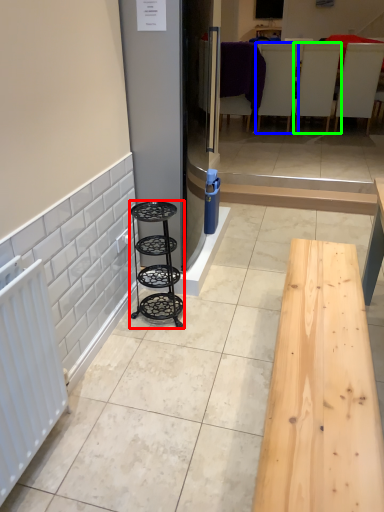
Question: Which is nearer to the furniture (highlighted by a red box)? furniture (highlighted by a blue box) or furniture (highlighted by a green box).

Choices:
 (A) furniture
 (B) furniture

Answer: (A)